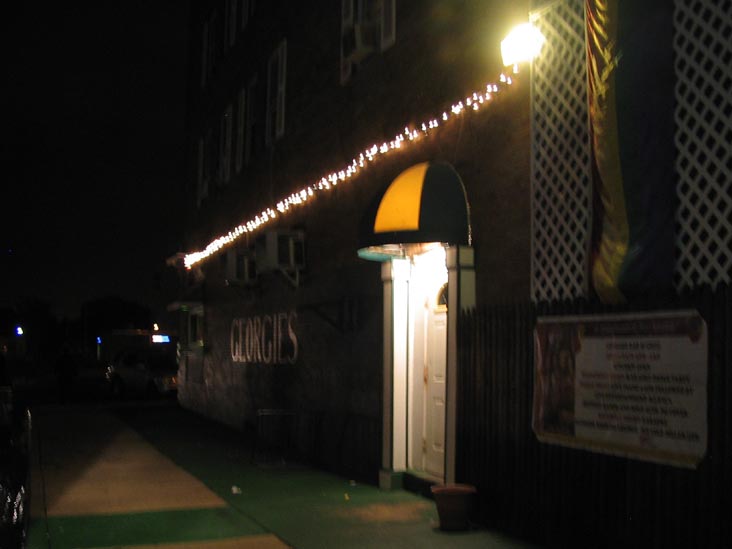
Find the location of a particular element. This screenshot has height=549, width=732. trash is located at coordinates (31, 498).